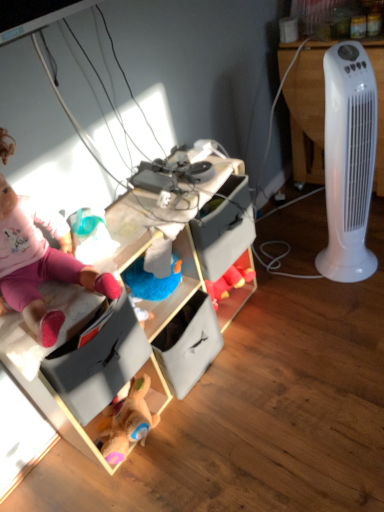
The width and height of the screenshot is (384, 512). I want to click on free space above wooden toy storage at center (from a real-world perspective), so click(x=132, y=232).